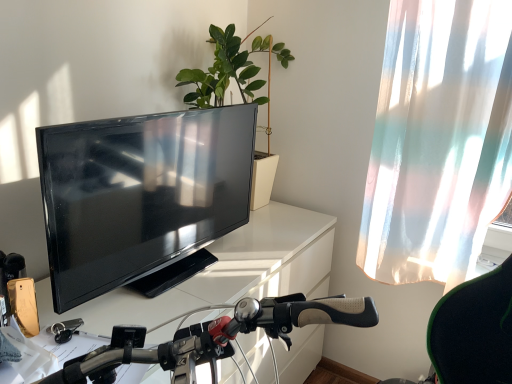
The width and height of the screenshot is (512, 384). Identify the location of free region under matte black tv at left (from a real-world perspective). (174, 264).